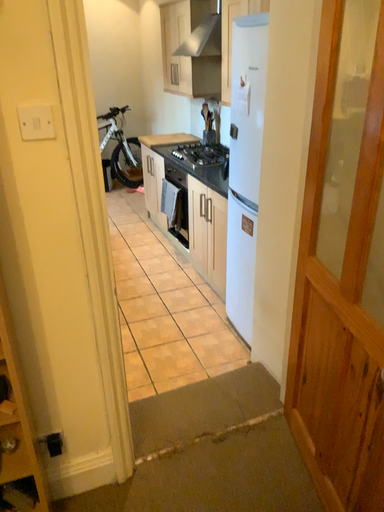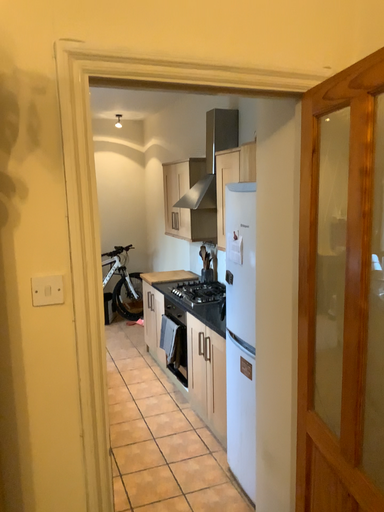
Question: Which way did the camera rotate in the video?

Choices:
 (A) rotated upward
 (B) rotated downward

Answer: (A)